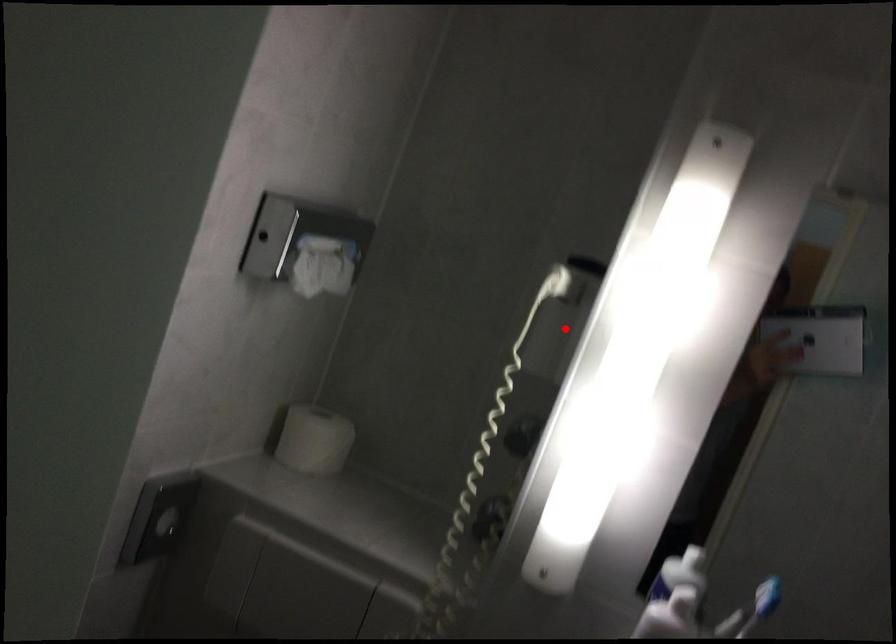
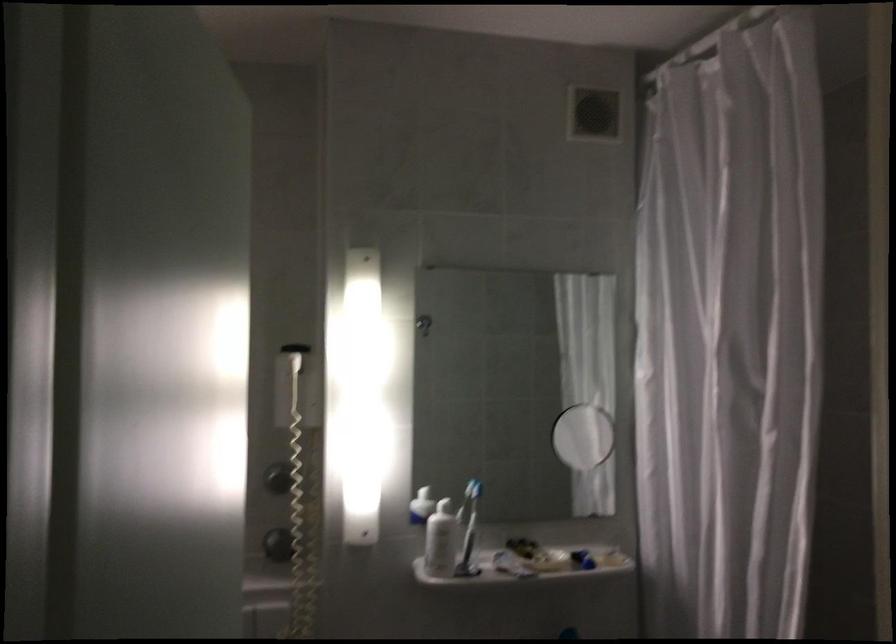
Question: I am providing you with two images of the same scene from different viewpoints. Image1 has a red point marked. In image2, the corresponding 3D location appears at what relative position? Reply with the corresponding letter.

Choices:
 (A) Closer
 (B) Farther

Answer: (B)